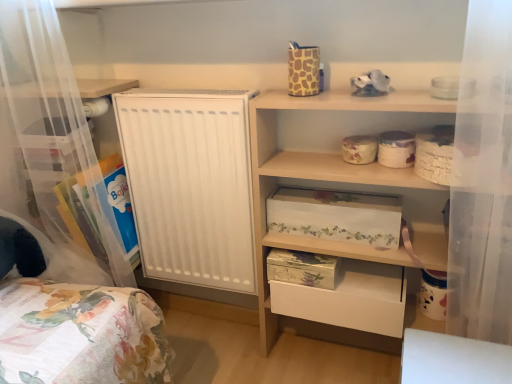
Question: Can you confirm if floral-patterned cardboard box at upper center, acting as the 1th storage box starting from the top, is bigger than clear plastic storage at left, which is the 1th shelf in left-to-right order?

Choices:
 (A) no
 (B) yes

Answer: (A)

Question: Would you consider floral-patterned cardboard box at upper center, the third storage box ordered from the bottom, to be distant from clear plastic storage at left, which is the second shelf from right to left?

Choices:
 (A) yes
 (B) no

Answer: (B)

Question: From the image's perspective, is floral-patterned cardboard box at upper center, the third storage box ordered from the bottom, under clear plastic storage at left, which is the second shelf from right to left?

Choices:
 (A) yes
 (B) no

Answer: (B)

Question: Does floral-patterned cardboard box at upper center, the third storage box ordered from the bottom, have a lesser height compared to clear plastic storage at left, which is the second shelf from right to left?

Choices:
 (A) yes
 (B) no

Answer: (A)

Question: Is floral-patterned cardboard box at upper center, acting as the 1th storage box starting from the top, to the right of clear plastic storage at left, which is the 1th shelf in left-to-right order, from the viewer's perspective?

Choices:
 (A) no
 (B) yes

Answer: (B)

Question: From a real-world perspective, is floral-patterned cardboard box at center, the second storage box positioned from the top, physically located above or below floral paper storage box at lower center, which is counted as the third storage box, starting from the top?

Choices:
 (A) below
 (B) above

Answer: (B)

Question: Is point (377, 201) closer or farther from the camera than point (281, 264)?

Choices:
 (A) farther
 (B) closer

Answer: (B)

Question: Which is correct: floral-patterned cardboard box at center, which is the second storage box in bottom-to-top order, is inside floral paper storage box at lower center, which is counted as the third storage box, starting from the top, or outside of it?

Choices:
 (A) outside
 (B) inside

Answer: (A)

Question: From the image's perspective, is floral-patterned cardboard box at center, which is the second storage box in bottom-to-top order, above or below floral paper storage box at lower center, which is counted as the third storage box, starting from the top?

Choices:
 (A) below
 (B) above

Answer: (B)

Question: Considering their positions, is clear plastic storage at left, which is the 1th shelf in left-to-right order, located in front of or behind floral-patterned cardboard box at upper center, the third storage box ordered from the bottom?

Choices:
 (A) front
 (B) behind

Answer: (B)

Question: Considering the positions of clear plastic storage at left, which is the 1th shelf in left-to-right order, and floral-patterned cardboard box at upper center, acting as the 1th storage box starting from the top, in the image, is clear plastic storage at left, which is the 1th shelf in left-to-right order, wider or thinner than floral-patterned cardboard box at upper center, acting as the 1th storage box starting from the top,?

Choices:
 (A) thin
 (B) wide

Answer: (B)

Question: Based on their sizes in the image, would you say clear plastic storage at left, which is the second shelf from right to left, is bigger or smaller than floral-patterned cardboard box at upper center, the third storage box ordered from the bottom?

Choices:
 (A) big
 (B) small

Answer: (A)

Question: From the image's perspective, is clear plastic storage at left, which is the second shelf from right to left, located above or below floral-patterned cardboard box at upper center, the third storage box ordered from the bottom?

Choices:
 (A) above
 (B) below

Answer: (B)

Question: Would you say clear plastic storage at left, which is the 1th shelf in left-to-right order, is to the left or to the right of floral paper storage box at lower center, which is the 1th storage box from bottom to top, in the picture?

Choices:
 (A) left
 (B) right

Answer: (A)

Question: From a real-world perspective, is clear plastic storage at left, which is the 1th shelf in left-to-right order, above or below floral paper storage box at lower center, which is the 1th storage box from bottom to top?

Choices:
 (A) above
 (B) below

Answer: (A)